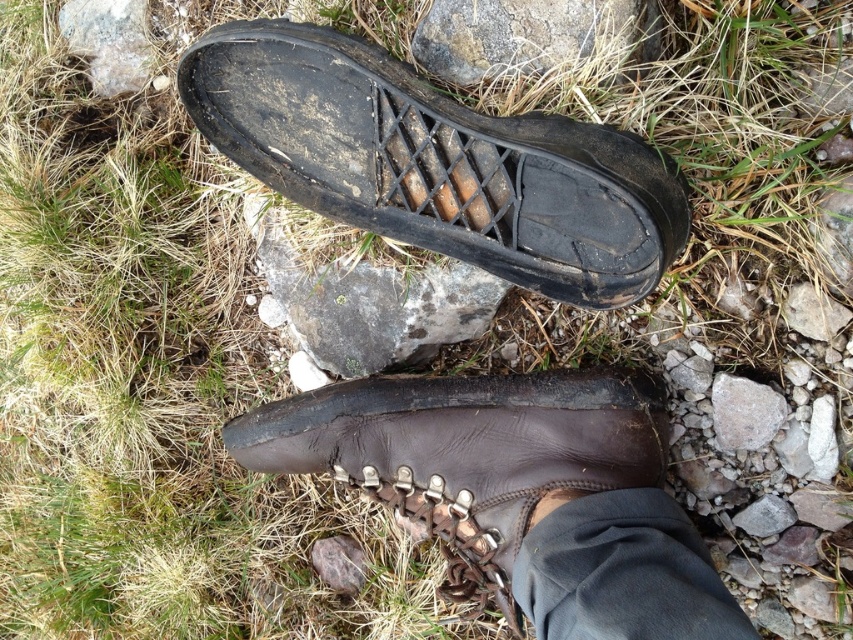
Question: Is brown leather boot at center wider than gray rock at upper center?

Choices:
 (A) yes
 (B) no

Answer: (A)

Question: Is gray/mottled rock at center closer to camera compared to gray rock at upper left?

Choices:
 (A) yes
 (B) no

Answer: (A)

Question: Which of the following is the closest to the observer?

Choices:
 (A) brown leather boot at center
 (B) gray rock at upper center
 (C) gray/mottled rock at center
 (D) gray rock at upper left

Answer: (B)

Question: Does gray/mottled rock at center lie in front of gray rock at upper center?

Choices:
 (A) yes
 (B) no

Answer: (B)

Question: Which point is closer to the camera?

Choices:
 (A) gray rock at upper left
 (B) gray/mottled rock at center

Answer: (B)

Question: Among these points, which one is farthest from the camera?

Choices:
 (A) (718, 412)
 (B) (109, 12)
 (C) (376, 456)
 (D) (323, 212)

Answer: (B)